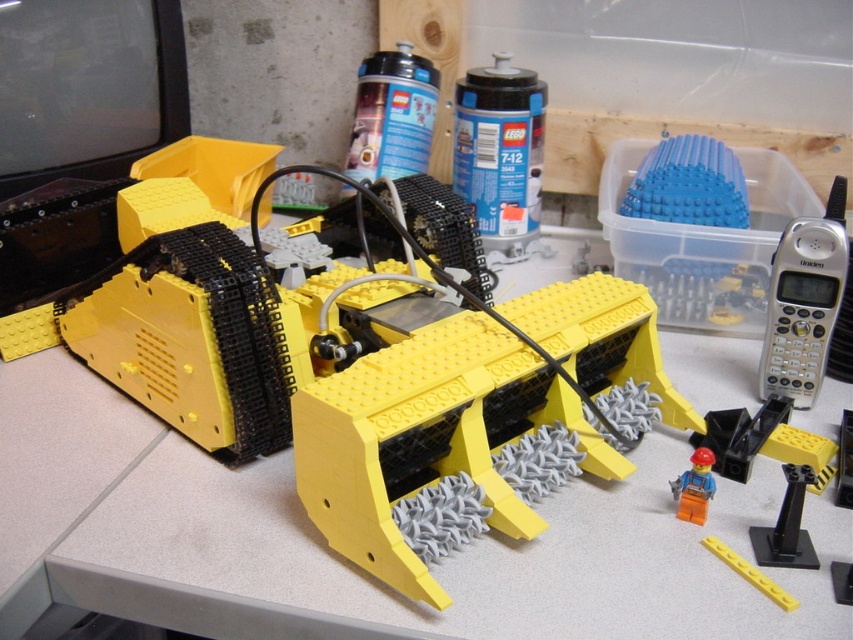
Question: Which object is positioned closest to the matte black spray can at upper center?

Choices:
 (A) blue plastic canister at upper center
 (B) silver metallic phone at right

Answer: (A)

Question: Is silver metallic phone at right below orange matte figure at lower right?

Choices:
 (A) yes
 (B) no

Answer: (B)

Question: Is yellow plastic toy at center wider than blue plastic canister at upper center?

Choices:
 (A) yes
 (B) no

Answer: (A)

Question: Which point is farther to the camera?

Choices:
 (A) matte black spray can at upper center
 (B) yellow plastic toy at center
 (C) blue plastic canister at upper center
 (D) orange matte figure at lower right

Answer: (A)

Question: Which point is farther from the camera taking this photo?

Choices:
 (A) (370, 125)
 (B) (471, 348)

Answer: (A)

Question: Is blue plastic canister at upper center to the left of matte black spray can at upper center from the viewer's perspective?

Choices:
 (A) yes
 (B) no

Answer: (B)